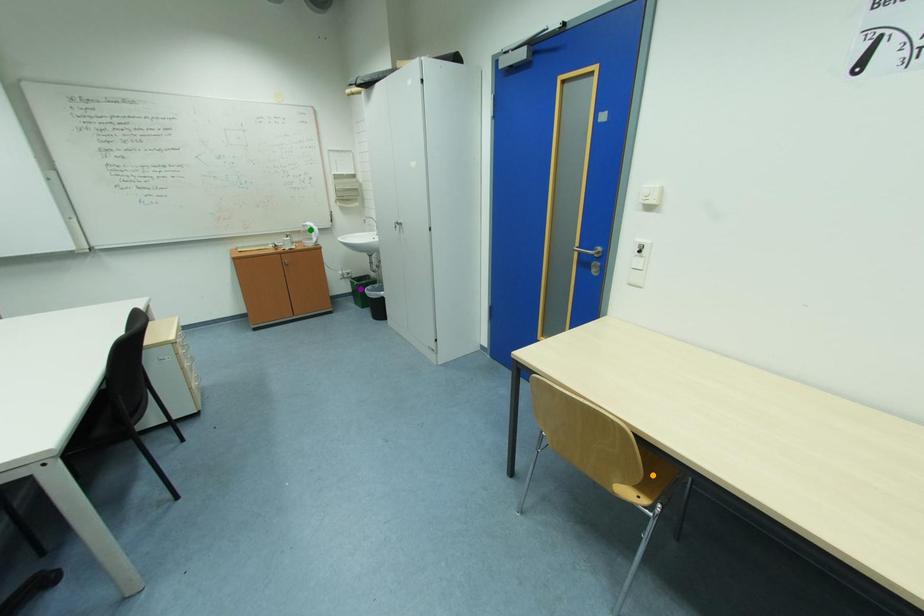
Order these from nearest to farthest:
purple point, green point, orange point

1. green point
2. purple point
3. orange point